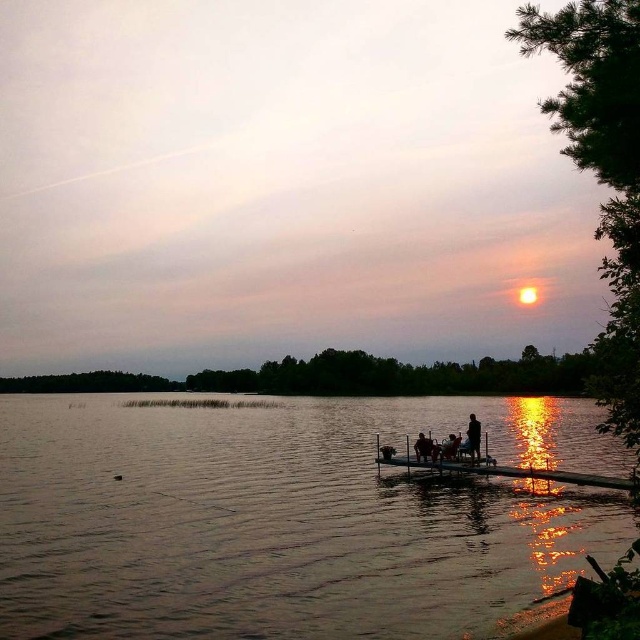
From the picture: You are standing on the dock and want to throw a pebble to create a ripple in the dull metallic water at center. If the silhouette figure at center is in the way, will you need to adjust your throw to avoid them?

The dull metallic water at center is 31.61 meters away from the silhouette figure at center. Since the figure is between you and the water, you would need to adjust your throw to avoid hitting them.

You are a photographer trying to capture the sunset at the lakeside. You notice a silhouette figure at center and a dark blue fabric jacket at center in your shot. Which object should you adjust your focus on if you want to highlight the larger subject?

The silhouette figure at center is larger than the dark blue fabric jacket at center, so you should focus on the silhouette figure at center to highlight the larger subject.

You are standing on the dock and want to take a photo of the silhouette figure at center and the dull metallic water at center. Which object should you focus on first if you want to capture both in the same frame without moving the camera?

You should focus on the silhouette figure at center first because the dull metallic water at center is to the left of it, so adjusting the camera to include both would require ensuring the water is on the left side of the frame.